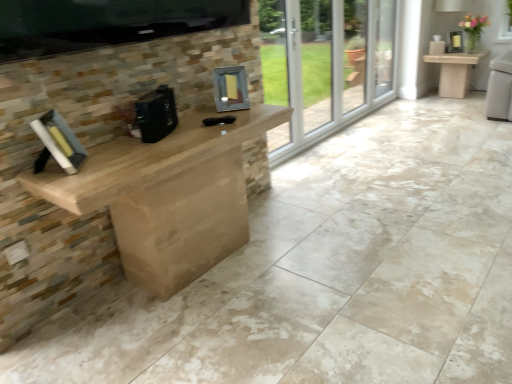
Question: Should I look upward or downward to see hardcover book at left?

Choices:
 (A) up
 (B) down

Answer: (A)

Question: Considering the relative positions of hardcover book at left and matte stone table at right in the image provided, is hardcover book at left behind matte stone table at right?

Choices:
 (A) yes
 (B) no

Answer: (B)

Question: From a real-world perspective, is hardcover book at left beneath matte stone table at right?

Choices:
 (A) no
 (B) yes

Answer: (A)

Question: From the image's perspective, is hardcover book at left below matte stone table at right?

Choices:
 (A) yes
 (B) no

Answer: (A)

Question: From a real-world perspective, is hardcover book at left physically above matte stone table at right?

Choices:
 (A) no
 (B) yes

Answer: (B)

Question: From the image's perspective, is hardcover book at left on top of matte stone table at right?

Choices:
 (A) no
 (B) yes

Answer: (A)

Question: Does hardcover book at left appear on the right side of matte stone table at right?

Choices:
 (A) no
 (B) yes

Answer: (A)

Question: Considering the relative sizes of black matte coffee machine at center, positioned as the first appliance in front-to-back order, and matte stone table at right in the image provided, is black matte coffee machine at center, positioned as the first appliance in front-to-back order, smaller than matte stone table at right?

Choices:
 (A) yes
 (B) no

Answer: (A)

Question: Considering the relative sizes of black matte coffee machine at center, which is the 1th appliance from left to right, and matte stone table at right in the image provided, is black matte coffee machine at center, which is the 1th appliance from left to right, taller than matte stone table at right?

Choices:
 (A) no
 (B) yes

Answer: (A)

Question: Could matte stone table at right be considered to be inside black matte coffee machine at center, which is the 1th appliance from left to right?

Choices:
 (A) no
 (B) yes

Answer: (A)

Question: Is black matte coffee machine at center, positioned as the first appliance in front-to-back order, at the left side of matte stone table at right?

Choices:
 (A) no
 (B) yes

Answer: (B)

Question: Is black matte coffee machine at center, which is the 1th appliance from left to right, to the right of matte stone table at right from the viewer's perspective?

Choices:
 (A) yes
 (B) no

Answer: (B)

Question: From the image's perspective, would you say black matte coffee machine at center, positioned as the first appliance in front-to-back order, is shown under matte stone table at right?

Choices:
 (A) no
 (B) yes

Answer: (B)

Question: Considering the relative sizes of black matte coffee machine at center, arranged as the second appliance when viewed from the right, and metallic silver frame at center, the 2th appliance in the front-to-back sequence, in the image provided, is black matte coffee machine at center, arranged as the second appliance when viewed from the right, taller than metallic silver frame at center, the 2th appliance in the front-to-back sequence,?

Choices:
 (A) yes
 (B) no

Answer: (B)